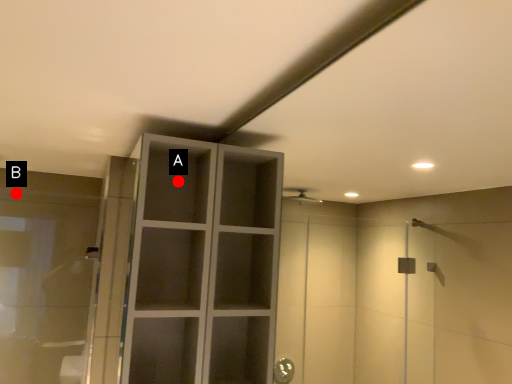
Question: Two points are circled on the image, labeled by A and B beside each circle. Which point is closer to the camera?

Choices:
 (A) A is closer
 (B) B is closer

Answer: (A)